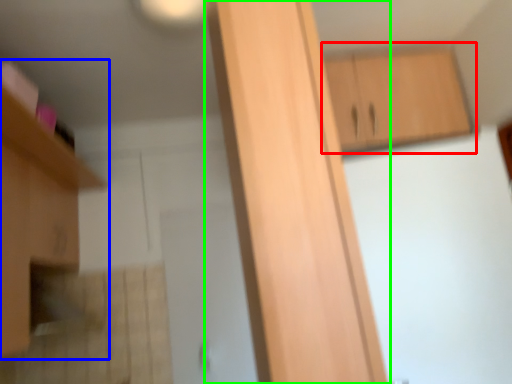
Question: Which object is positioned farthest from cabinetry (highlighted by a red box)? Select from cabinetry (highlighted by a blue box) and cabinetry (highlighted by a green box).

Choices:
 (A) cabinetry
 (B) cabinetry

Answer: (A)